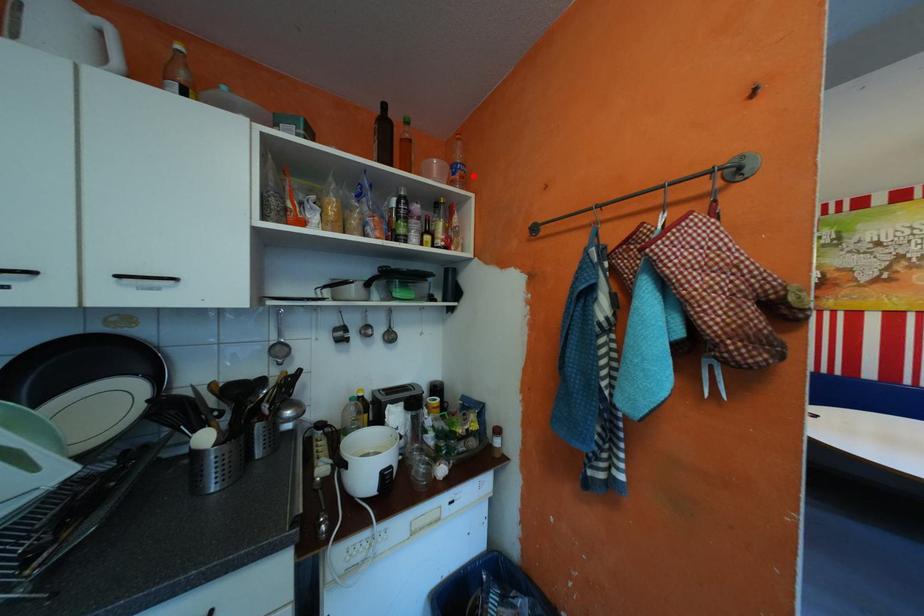
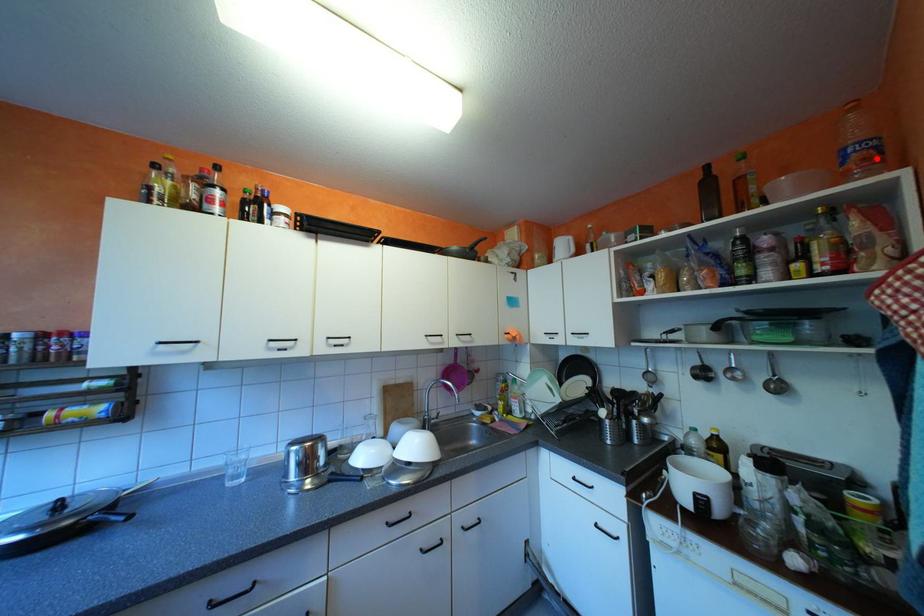
I am providing you with two images of the same scene from different viewpoints. A red point is marked on the first image and another point is marked on the second image. Do the highlighted points in image1 and image2 indicate the same real-world spot?

Yes